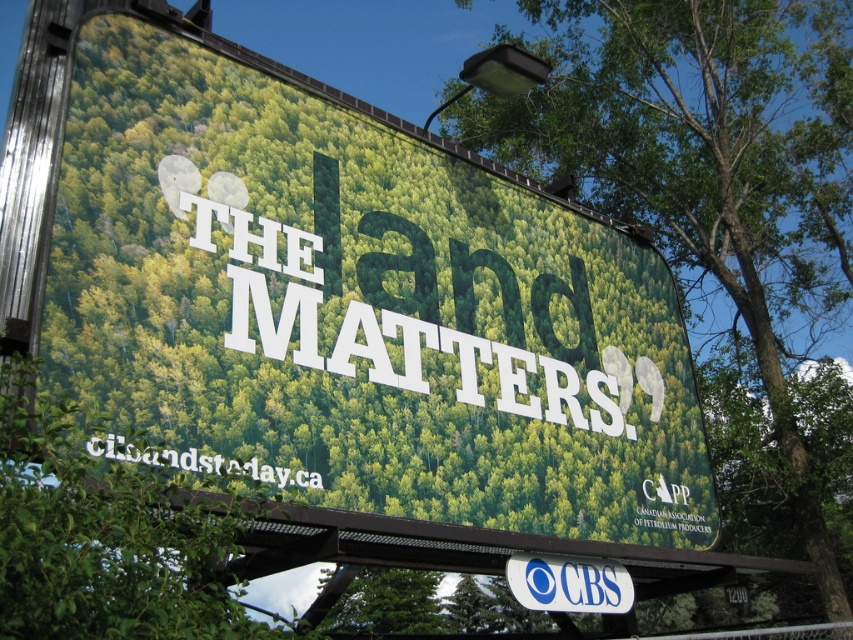
Consider the image. Does green leafy tree at upper right have a greater width compared to blue plastic cbs sign at center?

Correct, the width of green leafy tree at upper right exceeds that of blue plastic cbs sign at center.

Does green leafy tree at upper right appear on the right side of blue plastic cbs sign at center?

Indeed, green leafy tree at upper right is positioned on the right side of blue plastic cbs sign at center.

From the picture: Who is more distant from viewer, (778, 273) or (556, 609)?

The point (778, 273) is behind.

Where is `green leafy tree at upper right`? green leafy tree at upper right is located at coordinates (709, 170).

Which is above, green matte billboard at upper center or blue plastic cbs sign at center?

green matte billboard at upper center is above.

The width and height of the screenshot is (853, 640). I want to click on green matte billboard at upper center, so click(358, 307).

At what (x,y) coordinates should I click in order to perform the action: click on green matte billboard at upper center. Please return your answer as a coordinate pair (x, y). Image resolution: width=853 pixels, height=640 pixels. Looking at the image, I should click on (358, 307).

Is green leafy tree at lower left wider than blue plastic cbs sign at center?

Yes.

In the scene shown: Which is above, green leafy tree at lower left or blue plastic cbs sign at center?

green leafy tree at lower left is above.

The image size is (853, 640). What are the coordinates of `green leafy tree at lower left` in the screenshot? It's located at (105, 538).

At what (x,y) coordinates should I click in order to perform the action: click on green leafy tree at lower left. Please return your answer as a coordinate pair (x, y). The height and width of the screenshot is (640, 853). Looking at the image, I should click on (105, 538).